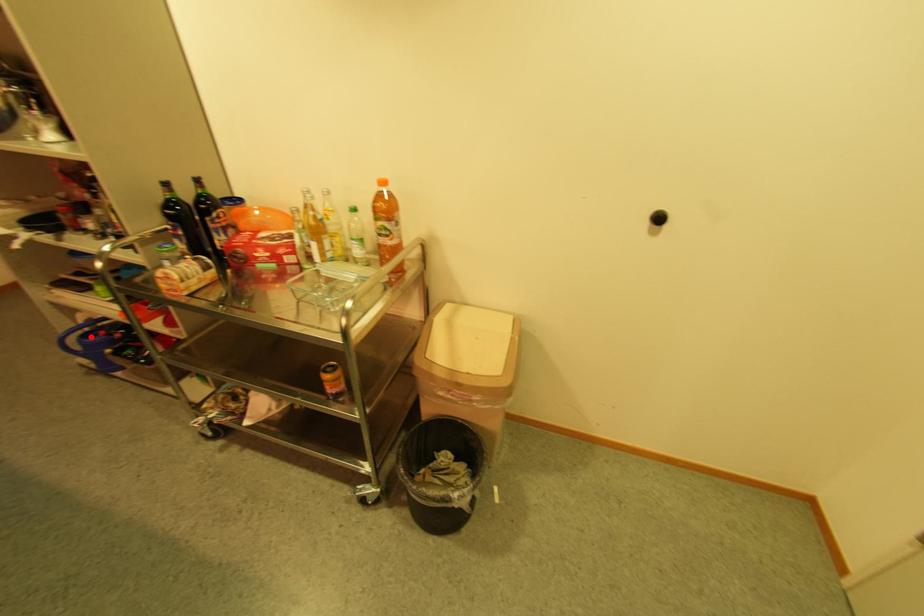
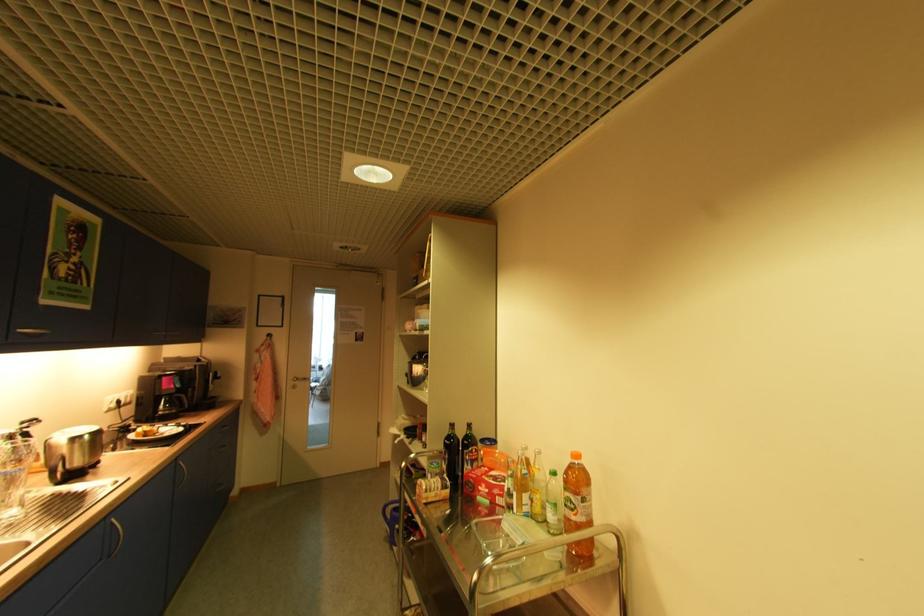
Question: I am providing you with two images of the same scene from different viewpoints. Image1 has a red point marked. In image2, the corresponding 3D location appears at what relative position? Reply with the corresponding letter.

Choices:
 (A) Closer
 (B) Farther

Answer: (B)